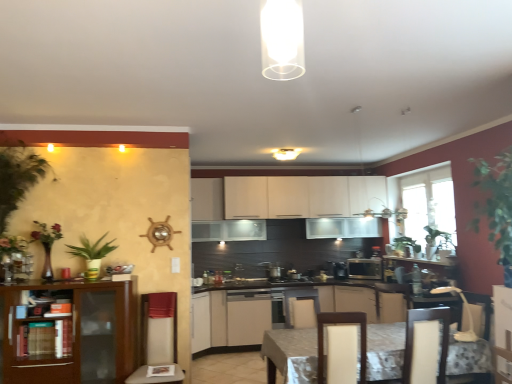
Question: Does white glossy cabinet at center, acting as the fifth cabinetry starting from the back, appear on the right side of black matte stove at center?

Choices:
 (A) no
 (B) yes

Answer: (B)

Question: From a real-world perspective, is white glossy cabinet at center, acting as the 1th cabinetry starting from the front, below black matte stove at center?

Choices:
 (A) no
 (B) yes

Answer: (A)

Question: Does white glossy cabinet at center, acting as the fifth cabinetry starting from the back, have a larger size compared to black matte stove at center?

Choices:
 (A) yes
 (B) no

Answer: (A)

Question: Considering the relative positions of white glossy cabinet at center, acting as the fifth cabinetry starting from the back, and black matte stove at center in the image provided, is white glossy cabinet at center, acting as the fifth cabinetry starting from the back, behind black matte stove at center?

Choices:
 (A) no
 (B) yes

Answer: (A)

Question: Does white glossy cabinet at center, acting as the 1th cabinetry starting from the front, turn towards black matte stove at center?

Choices:
 (A) yes
 (B) no

Answer: (A)

Question: In the image, is matte white cabinets at center, the 4th cabinetry in the back-to-front sequence, positioned in front of or behind satin silver toaster at center?

Choices:
 (A) front
 (B) behind

Answer: (A)

Question: Based on their sizes in the image, would you say matte white cabinets at center, the 4th cabinetry in the back-to-front sequence, is bigger or smaller than satin silver toaster at center?

Choices:
 (A) small
 (B) big

Answer: (B)

Question: From the image's perspective, is matte white cabinets at center, the 2th cabinetry viewed from the front, positioned above or below satin silver toaster at center?

Choices:
 (A) above
 (B) below

Answer: (B)

Question: In terms of height, does matte white cabinets at center, the 2th cabinetry viewed from the front, look taller or shorter compared to satin silver toaster at center?

Choices:
 (A) tall
 (B) short

Answer: (A)

Question: Is black plastic coffee machine at center bigger or smaller than beige fabric swivel chair at left, which ranks as the first swivel chair in left-to-right order?

Choices:
 (A) big
 (B) small

Answer: (B)

Question: From a real-world perspective, is black plastic coffee machine at center physically located above or below beige fabric swivel chair at left, acting as the third swivel chair starting from the right?

Choices:
 (A) below
 (B) above

Answer: (B)

Question: Relative to beige fabric swivel chair at left, acting as the third swivel chair starting from the right, is black plastic coffee machine at center in front or behind?

Choices:
 (A) front
 (B) behind

Answer: (B)

Question: Considering the relative positions of black plastic coffee machine at center and beige fabric swivel chair at left, which ranks as the first swivel chair in left-to-right order, in the image provided, is black plastic coffee machine at center to the left or to the right of beige fabric swivel chair at left, which ranks as the first swivel chair in left-to-right order,?

Choices:
 (A) right
 (B) left

Answer: (A)

Question: From a real-world perspective, is white matte cabinet at center, the 4th cabinetry in the front-to-back sequence, physically located above or below green leafy plant at left?

Choices:
 (A) above
 (B) below

Answer: (B)

Question: Looking at their shapes, would you say white matte cabinet at center, the 2th cabinetry when ordered from back to front, is wider or thinner than green leafy plant at left?

Choices:
 (A) wide
 (B) thin

Answer: (A)